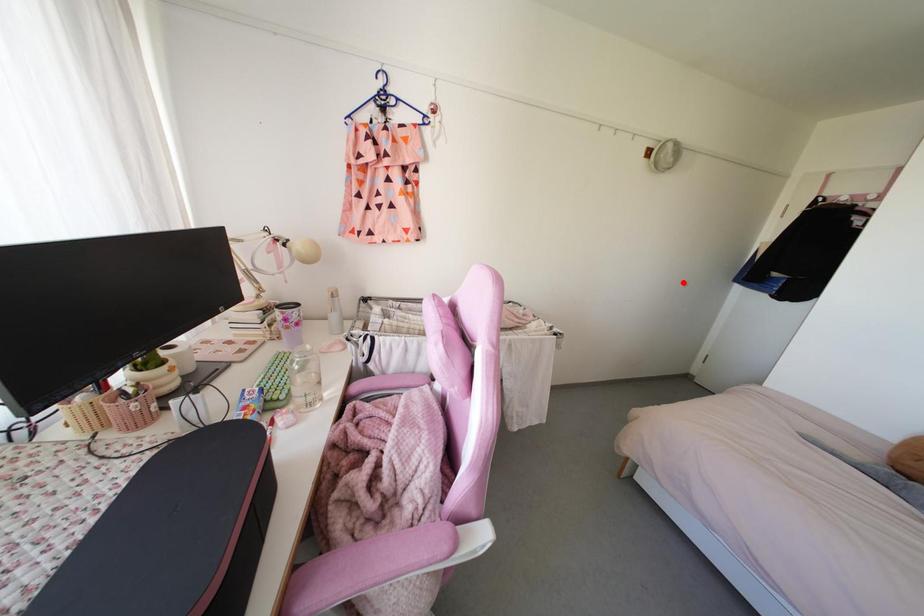
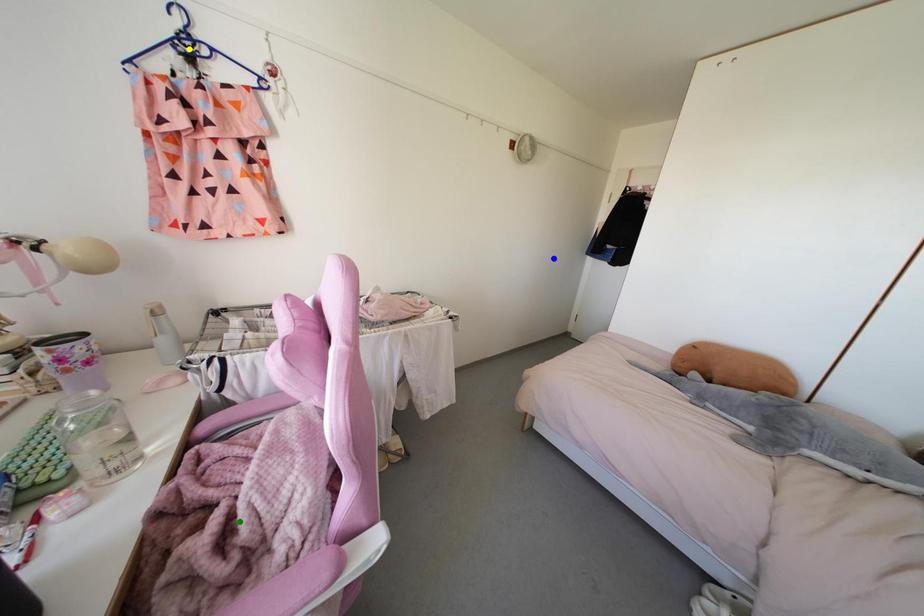
Question: I am providing you with two images of the same scene from different viewpoints. A red point is marked on the first image. You are given multiple points on the second image. Which mark in image 2 goes with the point in image 1?

Choices:
 (A) blue point
 (B) green point
 (C) yellow point

Answer: (A)